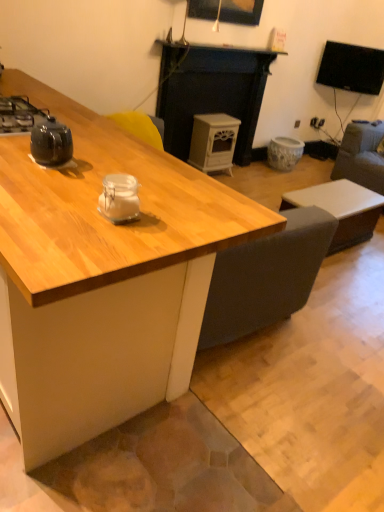
The image size is (384, 512). What do you see at coordinates (213, 142) in the screenshot? I see `white matte wood stove at center` at bounding box center [213, 142].

The height and width of the screenshot is (512, 384). What do you see at coordinates (361, 155) in the screenshot?
I see `dark gray fabric swivel chair at right` at bounding box center [361, 155].

The width and height of the screenshot is (384, 512). What are the coordinates of `white matte wood stove at center` in the screenshot? It's located at (213, 142).

From a real-world perspective, is yellow fabric armchair at center located higher than dark gray fabric swivel chair at right?

Correct, in the physical world, yellow fabric armchair at center is higher than dark gray fabric swivel chair at right.

Is dark gray fabric swivel chair at right inside yellow fabric armchair at center?

No, dark gray fabric swivel chair at right is not inside yellow fabric armchair at center.

Is yellow fabric armchair at center bigger than dark gray fabric swivel chair at right?

Incorrect, yellow fabric armchair at center is not larger than dark gray fabric swivel chair at right.

Relative to dark gray fabric swivel chair at right, is yellow fabric armchair at center in front or behind?

Visually, yellow fabric armchair at center is located in front of dark gray fabric swivel chair at right.

From the image's perspective, is wooden desk at center above white matte wood stove at center?

Incorrect, from the image's perspective, wooden desk at center is lower than white matte wood stove at center.

Considering the points (81, 165) and (215, 160), which point is behind, point (81, 165) or point (215, 160)?

The point (215, 160) is behind.

Does wooden desk at center have a greater width compared to white matte wood stove at center?

Yes, wooden desk at center is wider than white matte wood stove at center.

Would you say wooden desk at center is a long distance from white matte wood stove at center?

wooden desk at center is positioned a significant distance from white matte wood stove at center.

Does wooden desk at center appear on the left side of dark gray fabric swivel chair at right?

Correct, you'll find wooden desk at center to the left of dark gray fabric swivel chair at right.

Where is `swivel chair that appears above the wooden desk at center (from the image's perspective)`? Image resolution: width=384 pixels, height=512 pixels. swivel chair that appears above the wooden desk at center (from the image's perspective) is located at coordinates (361, 155).

From a real-world perspective, is wooden desk at center above or below dark gray fabric swivel chair at right?

wooden desk at center is situated higher than dark gray fabric swivel chair at right in the real world.

Is wooden desk at center next to dark gray fabric swivel chair at right and touching it?

No, wooden desk at center is not touching dark gray fabric swivel chair at right.

From the image's perspective, which one is positioned lower, white wood stove at center or wooden picture frame at upper center?

white wood stove at center appears lower in the image.

Is white wood stove at center wider than wooden picture frame at upper center?

Indeed, white wood stove at center has a greater width compared to wooden picture frame at upper center.

Does point (239, 95) appear closer or farther from the camera than point (253, 2)?

Point (239, 95) is positioned farther from the camera compared to point (253, 2).

From a real-world perspective, between white wood stove at center and wooden picture frame at upper center, who is vertically lower?

white wood stove at center is physically lower.

From a real-world perspective, is white matte wood stove at center on top of yellow fabric armchair at center?

No, from a real-world perspective, white matte wood stove at center is not above yellow fabric armchair at center.

Is white matte wood stove at center in contact with yellow fabric armchair at center?

No, white matte wood stove at center is not beside yellow fabric armchair at center.

Which point is more distant from viewer, (220, 137) or (143, 125)?

The point (220, 137) is farther from the camera.

Considering the sizes of objects white matte wood stove at center and yellow fabric armchair at center in the image provided, who is bigger, white matte wood stove at center or yellow fabric armchair at center?

white matte wood stove at center is bigger.

What's the angular difference between white matte coffee table at lower right and dark gray fabric swivel chair at right's facing directions?

white matte coffee table at lower right and dark gray fabric swivel chair at right are facing 88.1 degrees away from each other.

Between white matte coffee table at lower right and dark gray fabric swivel chair at right, which one has more height?

dark gray fabric swivel chair at right is taller.

Is white matte coffee table at lower right facing towards dark gray fabric swivel chair at right?

No, white matte coffee table at lower right is not turned towards dark gray fabric swivel chair at right.

From the image's perspective, is white matte coffee table at lower right beneath dark gray fabric swivel chair at right?

Yes, from the image's perspective, white matte coffee table at lower right is below dark gray fabric swivel chair at right.

Is white wood stove at center located outside black glossy tv at upper right?

white wood stove at center lies outside black glossy tv at upper right's area.

From a real-world perspective, which is physically above, white wood stove at center or black glossy tv at upper right?

black glossy tv at upper right.

Locate an element on the screen. television lying above the white wood stove at center (from the image's perspective) is located at coordinates (351, 68).

Could you tell me if white wood stove at center is turned towards black glossy tv at upper right?

No, white wood stove at center is not turned towards black glossy tv at upper right.

In order to click on swivel chair on the right of yellow fabric armchair at center in this screenshot , I will do `click(361, 155)`.

Image resolution: width=384 pixels, height=512 pixels. I want to click on desk that appears in front of the white matte wood stove at center, so click(103, 278).

Based on their spatial positions, is black glossy kettle at left or black glossy tv at upper right further from white matte wood stove at center?

black glossy kettle at left is further to white matte wood stove at center.

Considering their positions, is white wood stove at center positioned further to black glossy kettle at left than white matte coffee table at lower right?

The object further to black glossy kettle at left is white wood stove at center.

Which object lies nearer to the anchor point white matte wood stove at center, dark gray fabric swivel chair at right or white wood stove at center?

white wood stove at center is closer to white matte wood stove at center.

Considering their positions, is black glossy kettle at left positioned closer to white matte wood stove at center than wooden desk at center?

black glossy kettle at left.

Which object lies further to the anchor point black glossy tv at upper right, white matte wood stove at center or black glossy kettle at left?

black glossy kettle at left is positioned further to the anchor black glossy tv at upper right.

From the picture: When comparing their distances from dark gray fabric swivel chair at right, does white wood stove at center or black glossy kettle at left seem closer?

white wood stove at center lies closer to dark gray fabric swivel chair at right than the other object.

Looking at the image, which one is located further to black glossy tv at upper right, white wood stove at center or white matte coffee table at lower right?

white matte coffee table at lower right lies further to black glossy tv at upper right than the other object.

When comparing their distances from matte black teapot at left, does black glossy tv at upper right or black glossy kettle at left seem further?

Among the two, black glossy tv at upper right is located further to matte black teapot at left.

What are the coordinates of `fireplace between matte black teapot at left and black glossy tv at upper right from front to back` in the screenshot? It's located at (210, 92).

At what (x,y) coordinates should I click in order to perform the action: click on armchair located between matte black teapot at left and white matte wood stove at center in the depth direction. Please return your answer as a coordinate pair (x, y). Looking at the image, I should click on (139, 127).

Find the location of a particular element. This screenshot has width=384, height=512. armchair between matte black teapot at left and dark gray fabric swivel chair at right from left to right is located at coordinates (139, 127).

Identify the location of fireplace between black glossy kettle at left and dark gray fabric swivel chair at right from left to right. Image resolution: width=384 pixels, height=512 pixels. (210, 92).